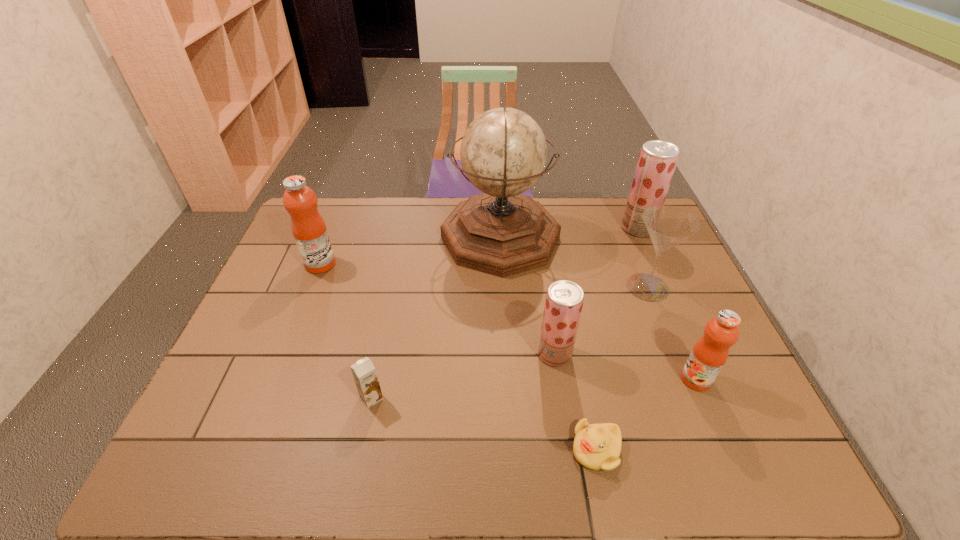
The width and height of the screenshot is (960, 540). I want to click on globe, so click(501, 232).

This screenshot has height=540, width=960. I want to click on the farther strawberry fruit juice, so click(x=657, y=160).

Where is `the farthest fruit juice`? The height and width of the screenshot is (540, 960). the farthest fruit juice is located at coordinates (657, 160).

The width and height of the screenshot is (960, 540). What are the coordinates of `the leftmost fruit juice` in the screenshot? It's located at (309, 230).

Where is `the third nearest fruit juice`? The image size is (960, 540). the third nearest fruit juice is located at coordinates (309, 230).

This screenshot has height=540, width=960. I want to click on flute glass, so click(668, 226).

Locate an element on the screen. Image resolution: width=960 pixels, height=540 pixels. the nearer strawberry fruit juice is located at coordinates (564, 300).

Identify the location of the third fruit juice from right to left. This screenshot has height=540, width=960. (564, 300).

This screenshot has height=540, width=960. I want to click on the smaller orange fruit juice, so click(709, 354).

Where is `the nearer orange fruit juice`? the nearer orange fruit juice is located at coordinates (709, 354).